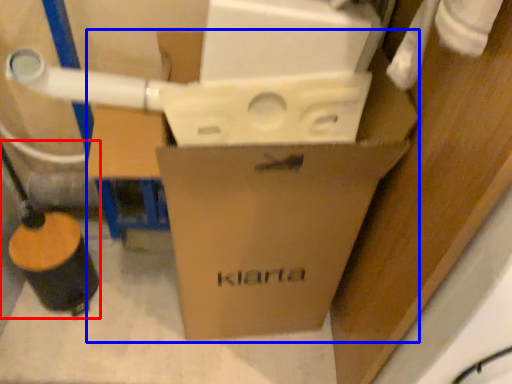
Question: Among these objects, which one is nearest to the camera, water pipe (highlighted by a red box) or box (highlighted by a blue box)?

Choices:
 (A) water pipe
 (B) box

Answer: (B)